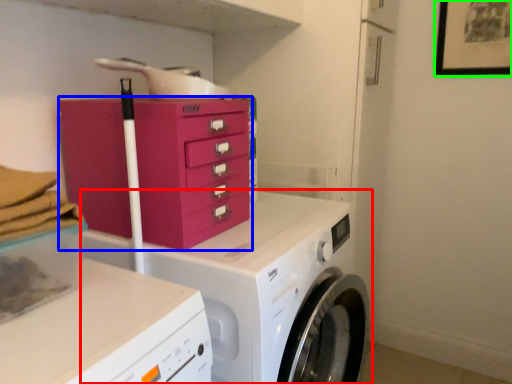
Question: Which object is positioned farthest from washing machine (highlighted by a red box)? Select from chest of drawers (highlighted by a blue box) and picture frame (highlighted by a green box).

Choices:
 (A) chest of drawers
 (B) picture frame

Answer: (B)